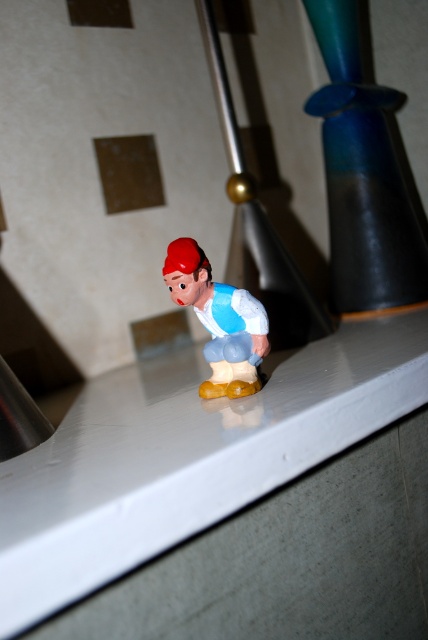
You are standing in front of the mirror with the figurine on it. There are two points marked on the mirror at coordinates point (x=50, y=531) and point (x=183, y=248). Which point is closer to you?

Point (x=50, y=531) is in front of point (x=183, y=248), so it is closer to you.

You are setting up a small display and want to place both the white glossy counter top at center and the matte plastic toy at center. Since you want the toy to be visible from above, which object should you place higher?

The white glossy counter top at center has a greater height compared to matte plastic toy at center, so you should place the matte plastic toy at center on top of the white glossy counter top at center to ensure it is visible from above.

You are setting up a display in a store and need to place both the white glossy counter top at center and the matte plastic toy at center. Since the counter top is larger, where should you position the matte plastic toy to ensure it is visible and not overshadowed?

The white glossy counter top at center is bigger than the matte plastic toy at center, so you should place the matte plastic toy at center on top of the counter top to ensure it is visible and not overshadowed.